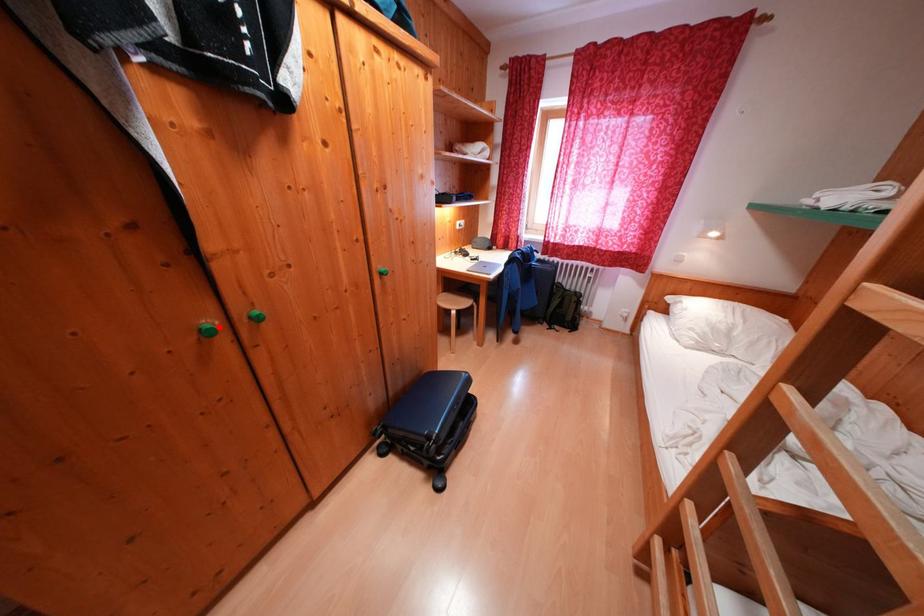
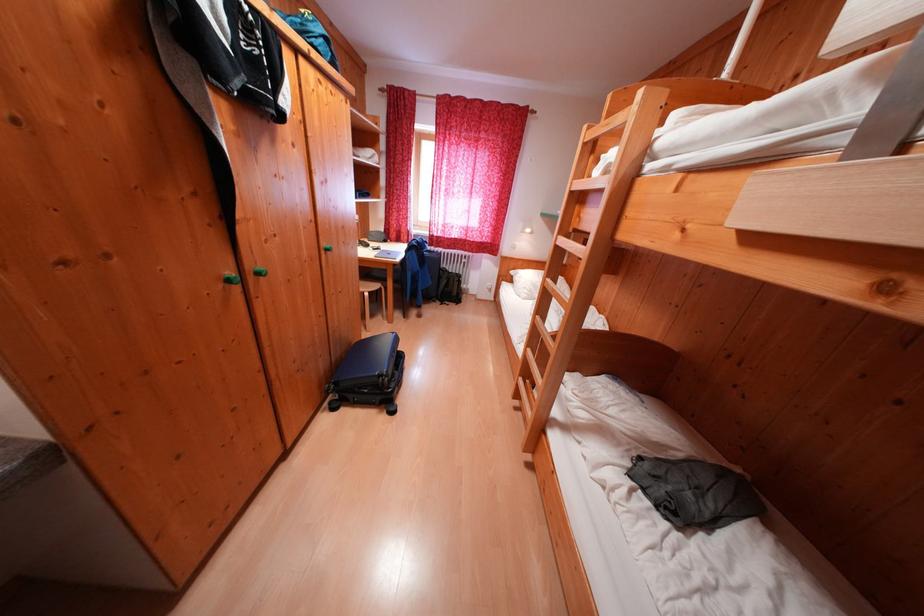
Where in the second image is the point corresponding to the highlighted location from the first image?

(238, 278)